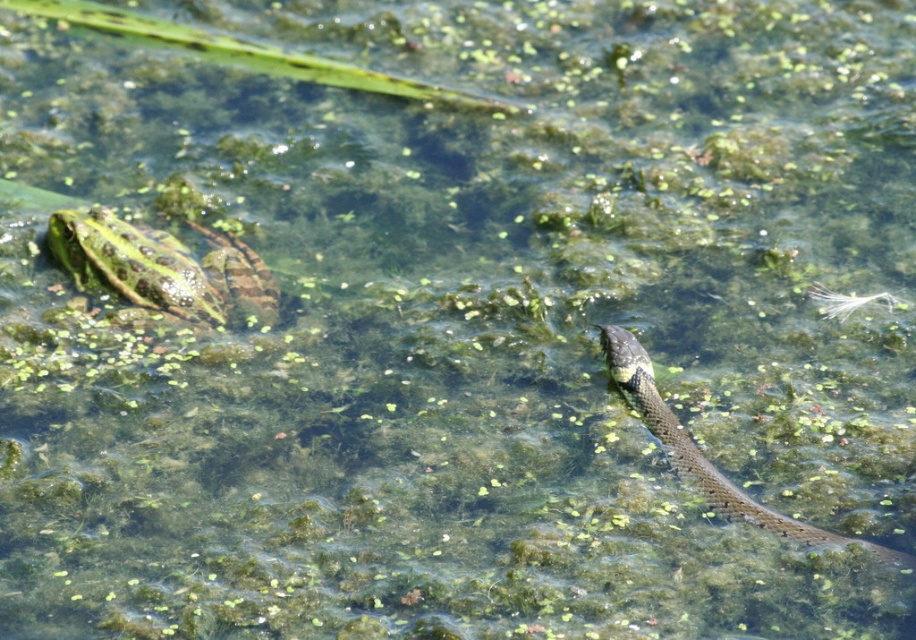
Question: Among these points, which one is nearest to the camera?

Choices:
 (A) (101, 250)
 (B) (803, 524)

Answer: (B)

Question: Does speckled green skin at upper left appear on the right side of green spotted skin at upper left?

Choices:
 (A) no
 (B) yes

Answer: (A)

Question: Can you confirm if speckled green skin at upper left is positioned to the left of green spotted skin at upper left?

Choices:
 (A) no
 (B) yes

Answer: (B)

Question: Can you confirm if speckled green skin at upper left is positioned above green spotted skin at upper left?

Choices:
 (A) no
 (B) yes

Answer: (B)

Question: Which object is farther from the camera taking this photo?

Choices:
 (A) green spotted skin at upper left
 (B) speckled green skin at upper left

Answer: (B)